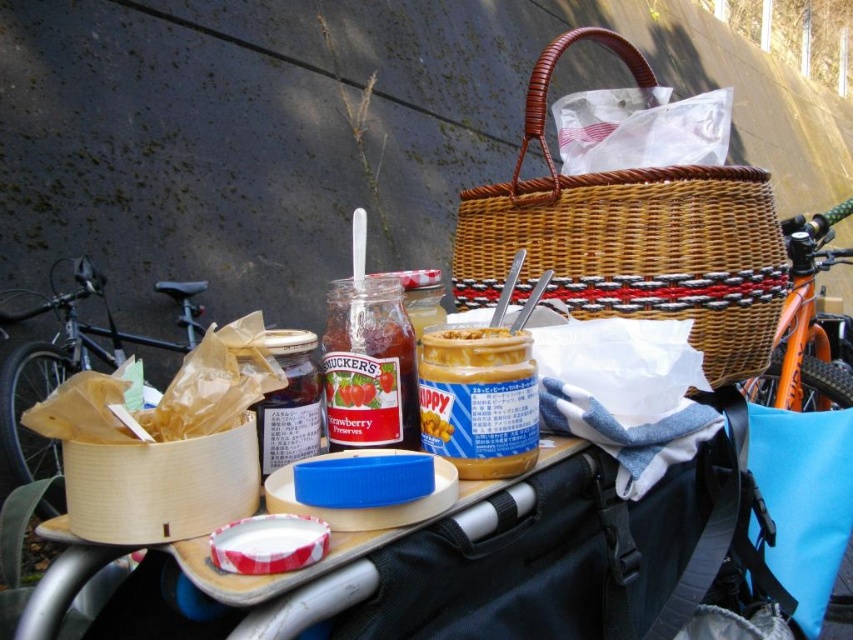
Question: Can you confirm if woven brown basket at upper center is positioned above peanut butter jar at center?

Choices:
 (A) no
 (B) yes

Answer: (B)

Question: Can you confirm if orange matte bicycle at upper right is wider than peanut butter jar at center?

Choices:
 (A) yes
 (B) no

Answer: (A)

Question: Is orange matte bicycle at upper right further to camera compared to peanut butter jar at center?

Choices:
 (A) yes
 (B) no

Answer: (A)

Question: Which point is closer to the camera?

Choices:
 (A) (494, 336)
 (B) (457, 472)
 (C) (814, 278)
 (D) (601, 204)

Answer: (B)

Question: Which of the following is the farthest from the observer?

Choices:
 (A) (787, 397)
 (B) (694, 316)
 (C) (448, 337)

Answer: (A)

Question: Which point is farther to the camera?

Choices:
 (A) (480, 339)
 (B) (759, 387)
 (C) (502, 232)

Answer: (B)